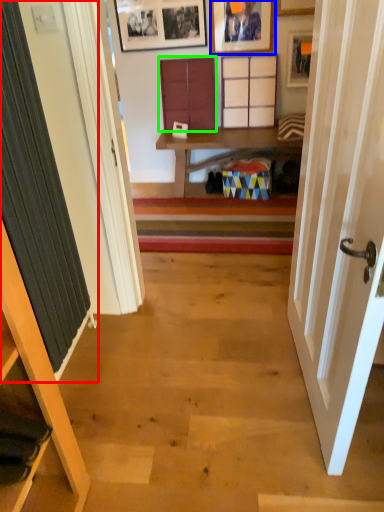
Question: Which is nearer to the curtain (highlighted by a red box)? picture frame (highlighted by a blue box) or cabinet (highlighted by a green box).

Choices:
 (A) picture frame
 (B) cabinet

Answer: (B)